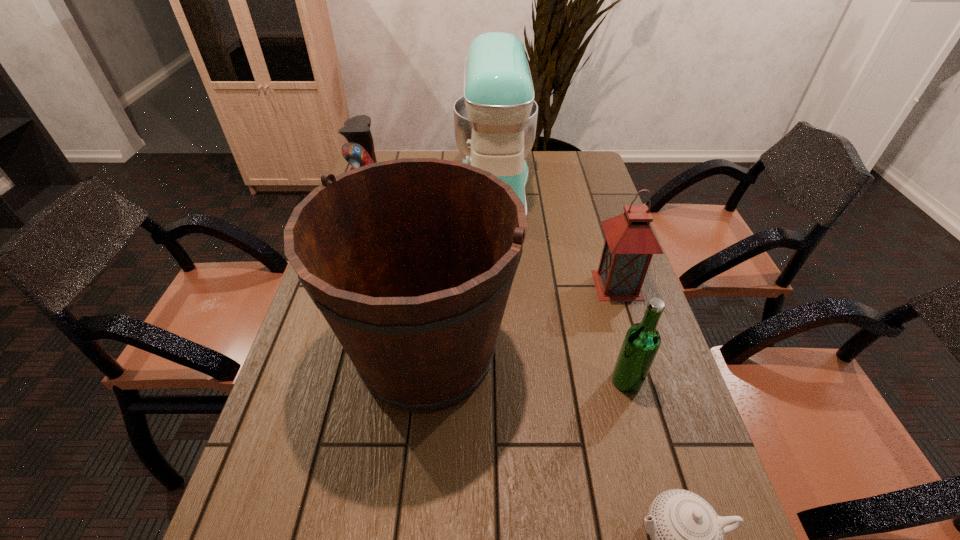
You are a GUI agent. You are given a task and a screenshot of the screen. Output one action in this format:
    pyautogui.click(x=<x>, y=<y>)
    Task: Click on the vacant space at the far left corner of the desktop
    The image size is (960, 540).
    Given the screenshot: What is the action you would take?
    pyautogui.click(x=381, y=154)

You are a GUI agent. You are given a task and a screenshot of the screen. Output one action in this format:
    pyautogui.click(x=<x>, y=<y>)
    Task: Click on the object that ranks as the closest to the bucket
    
    Given the screenshot: What is the action you would take?
    click(x=642, y=341)

Locate an element on the screen. object that is the third closest to the lantern is located at coordinates (411, 261).

You are a GUI agent. You are given a task and a screenshot of the screen. Output one action in this format:
    pyautogui.click(x=<x>, y=<y>)
    Task: Click on the vacant space that satisfies the following two spatial constraints: 1. at the face of the parrot; 2. on the left side of the beer bottle
    The width and height of the screenshot is (960, 540).
    Given the screenshot: What is the action you would take?
    pyautogui.click(x=316, y=381)

At what (x,y) coordinates should I click in order to perform the action: click on free spot that satisfies the following two spatial constraints: 1. at the base of the mixer; 2. on the left side of the lantern. Please return your answer as a coordinate pair (x, y). The height and width of the screenshot is (540, 960). Looking at the image, I should click on (498, 285).

At what (x,y) coordinates should I click in order to perform the action: click on free region that satisfies the following two spatial constraints: 1. at the base of the mixer; 2. on the right side of the lantern. Please return your answer as a coordinate pair (x, y). The height and width of the screenshot is (540, 960). Looking at the image, I should click on (498, 285).